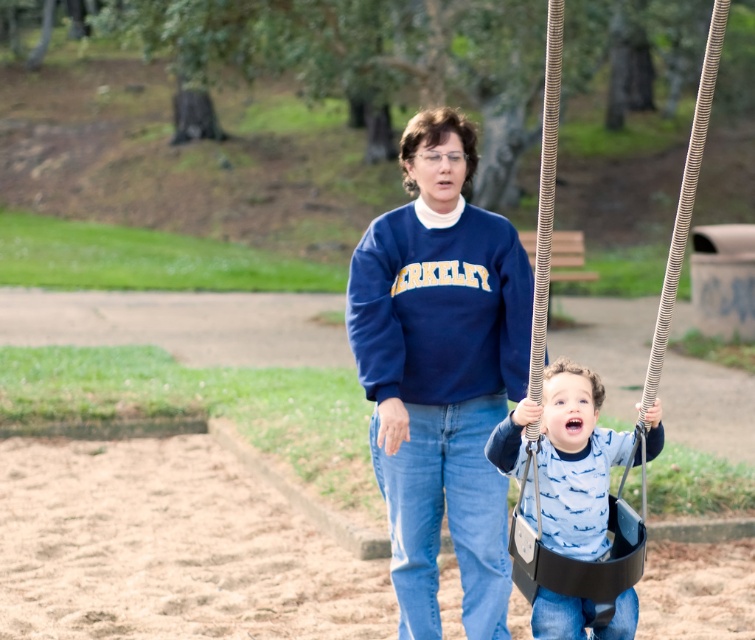
Consider the image. You are a tailor who needs to measure the distance between the navy blue sweatshirt at center and the black plastic swing at center. Based on the image, can you confirm if the distance is more than 3 feet?

The navy blue sweatshirt at center is 35.74 inches from the black plastic swing at center. Since 3 feet equals 36 inches, the distance is just under 3 feet. Therefore, the distance is not more than 3 feet.

What is the spatial relationship between the black plastic swing at center and the matte black swing seat at center?

The black plastic swing at center is in front of the matte black swing seat at center.